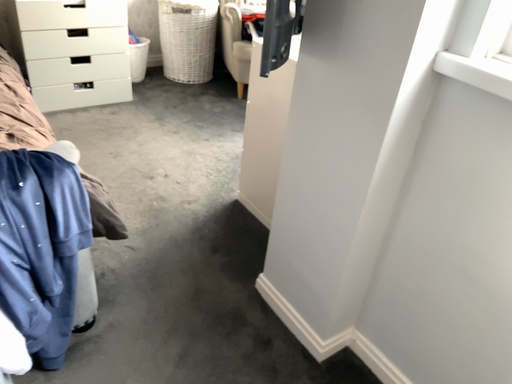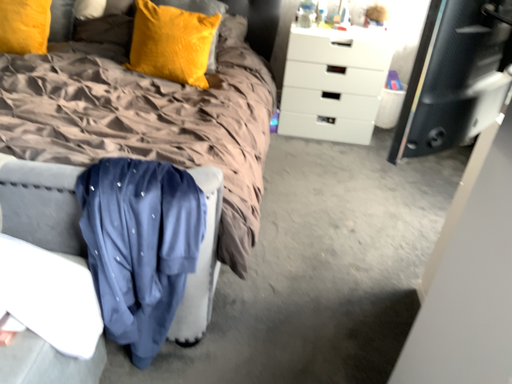
Question: How did the camera likely rotate when shooting the video?

Choices:
 (A) rotated right
 (B) rotated left

Answer: (B)